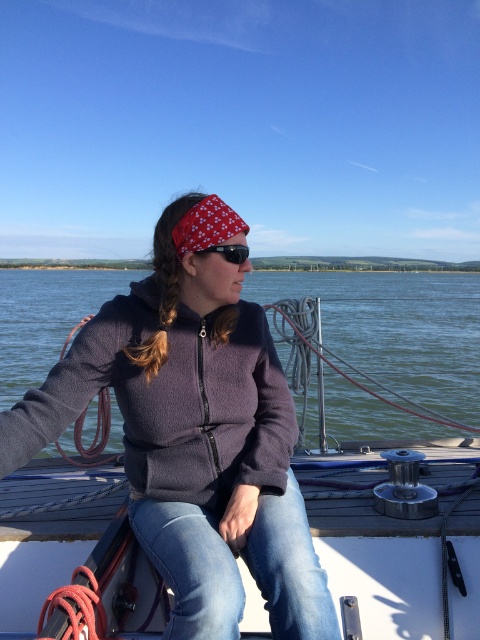
You are standing on the deck of the sailboat and want to pick up an object located at point (164, 248). If you can reach 2 meters, will you be able to reach it?

The distance between you and the point (164, 248) is 2.07 meters, so you cannot reach it since it is slightly farther than your 2 meter reach.

You are standing on the deck of the sailboat and want to take a photo of the point at coordinates (x=180, y=208). If your camera is 2.06 meters away from that point, can you reach it without moving your feet?

The point at coordinates (x=180, y=208) is 2.06 meters away from the camera. Since the camera is already at that distance, you can reach it without moving your feet if your arm can extend that far, but typically, 2.06 meters is beyond normal arm reach. However, the question states the camera is at that distance, so technically, you are already positioned correctly, but the answer depends on arm length. However, the given information only specifies the distance between the point and the camera, so based on the

Based on the scene description, where is the green water at center located in the image?

The green water at center is located at point coordinates of (396, 328).